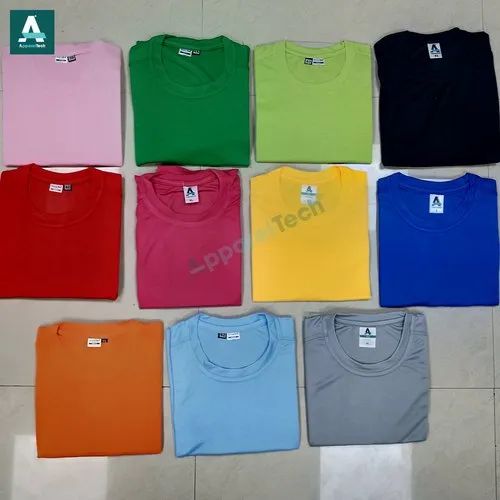
What are the coordinates of `floor` in the screenshot? It's located at pyautogui.click(x=320, y=22), pyautogui.click(x=459, y=449).